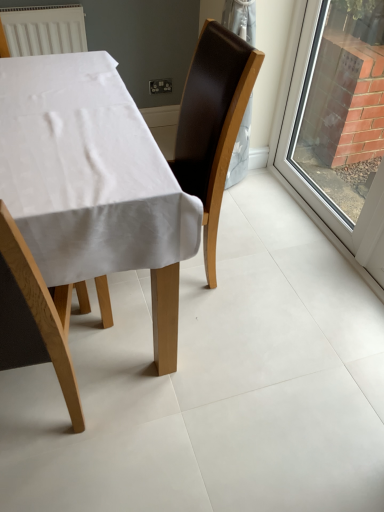
Where is `vacant space to the right of brown leather chair at center, the first chair positioned from the back`? Image resolution: width=384 pixels, height=512 pixels. vacant space to the right of brown leather chair at center, the first chair positioned from the back is located at coordinates (265, 275).